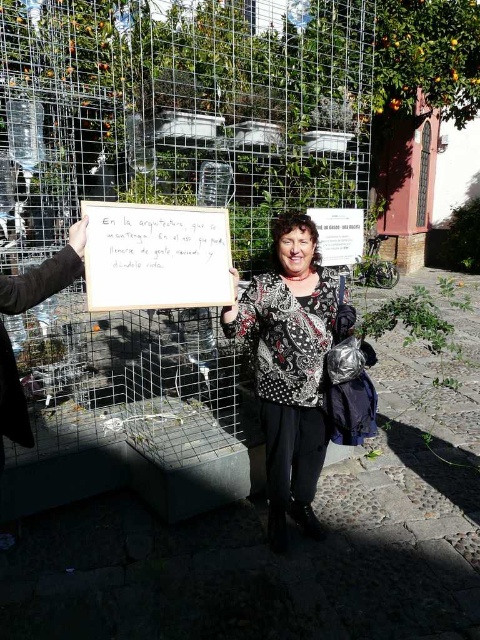
Who is more forward, (247, 129) or (315, 328)?

Point (315, 328) is more forward.

Is point (22, 54) positioned behind point (312, 326)?

That is True.

Is point (166, 45) behind point (315, 240)?

That is True.

Where is `wire mesh fence at center`? Image resolution: width=480 pixels, height=640 pixels. wire mesh fence at center is located at coordinates (179, 115).

Is patterned fabric jacket at center shorter than white paper at center?

Incorrect, patterned fabric jacket at center's height does not fall short of white paper at center's.

Locate an element on the screen. This screenshot has height=640, width=480. patterned fabric jacket at center is located at coordinates (290, 368).

At what (x,y) coordinates should I click in order to perform the action: click on patterned fabric jacket at center. Please return your answer as a coordinate pair (x, y). Image resolution: width=480 pixels, height=640 pixels. Looking at the image, I should click on (290, 368).

Locate an element on the screen. white paper at center is located at coordinates (156, 257).